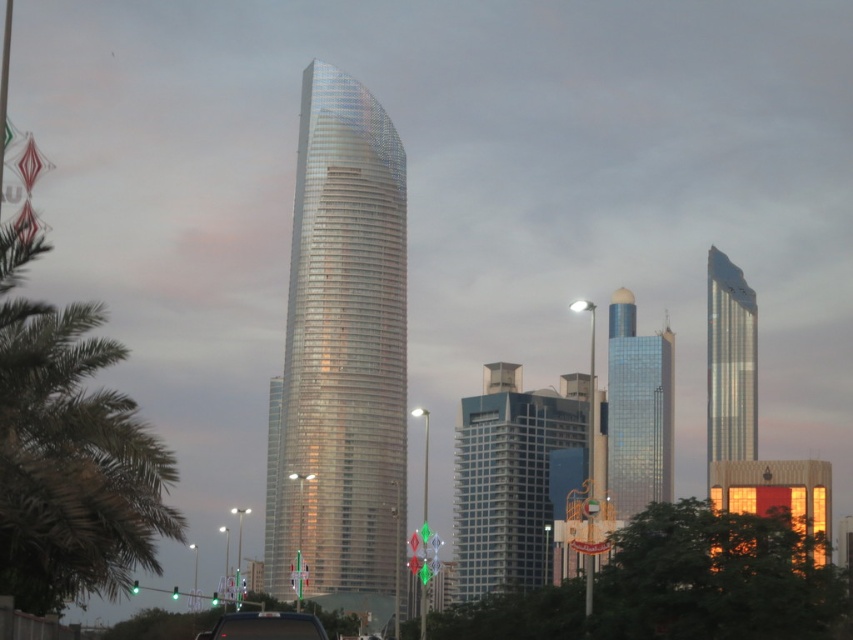
Does green leafy palm tree at left have a lesser height compared to glossy glass skyscraper at center?

Yes.

Which is behind, point (85, 579) or point (668, 416)?

The point (668, 416) is more distant.

Is point (102, 307) less distant than point (671, 410)?

Yes, point (102, 307) is closer to viewer.

The image size is (853, 640). What are the coordinates of `green leafy palm tree at left` in the screenshot? It's located at (70, 452).

Which is above, green leafy palm tree at left or blue glass building at center?

green leafy palm tree at left is above.

Where is `green leafy palm tree at left`? This screenshot has width=853, height=640. green leafy palm tree at left is located at coordinates (70, 452).

Can you confirm if green leafy palm tree at left is wider than black glossy car at center?

Incorrect, green leafy palm tree at left's width does not surpass black glossy car at center's.

Does green leafy palm tree at left appear on the right side of black glossy car at center?

In fact, green leafy palm tree at left is to the left of black glossy car at center.

Measure the distance between point (173,458) and camera.

Point (173,458) is 357.50 meters away from camera.

The height and width of the screenshot is (640, 853). In order to click on green leafy palm tree at left in this screenshot , I will do `click(70, 452)`.